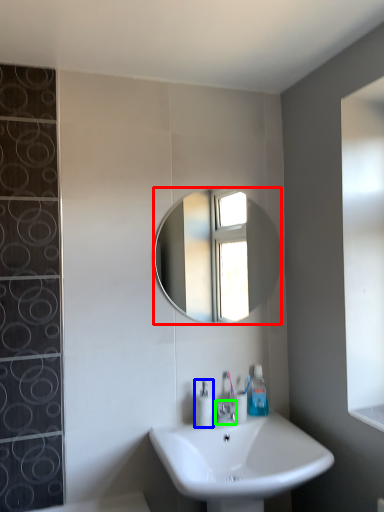
Question: Which is nearer to the mirror (highlighted by a red box)? soap dispenser (highlighted by a blue box) or tap (highlighted by a green box).

Choices:
 (A) soap dispenser
 (B) tap

Answer: (A)